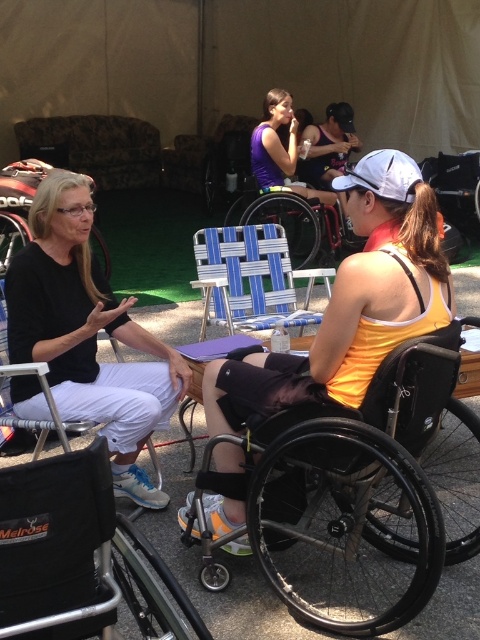
Where is `yellow fabric tank top at center`? Image resolution: width=480 pixels, height=640 pixels. yellow fabric tank top at center is located at coordinates (351, 301).

Between point (425, 323) and point (67, 221), which one is positioned behind?

Point (67, 221)

Locate an element on the screen. The width and height of the screenshot is (480, 640). yellow fabric tank top at center is located at coordinates (351, 301).

Who is taller, matte black shirt at left or blue woven plastic beach chair at center?

matte black shirt at left

Find the location of `matte black shirt at left`. matte black shirt at left is located at coordinates (87, 333).

Does point (60, 192) lie behind point (230, 320)?

No, it is in front of (230, 320).

The width and height of the screenshot is (480, 640). Identify the location of matte black shirt at left. (87, 333).

Is point (256, 472) farther from camera compared to point (286, 144)?

No, (256, 472) is in front of (286, 144).

At what (x,y) coordinates should I click in order to perform the action: click on black plastic wheelchair at lower right. Please return your answer as a coordinate pair (x, y). This screenshot has height=640, width=480. Looking at the image, I should click on (369, 486).